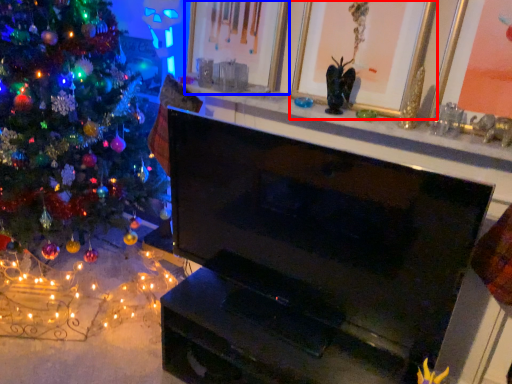
Question: Which object is closer to the camera taking this photo, picture frame (highlighted by a red box) or picture frame (highlighted by a blue box)?

Choices:
 (A) picture frame
 (B) picture frame

Answer: (A)